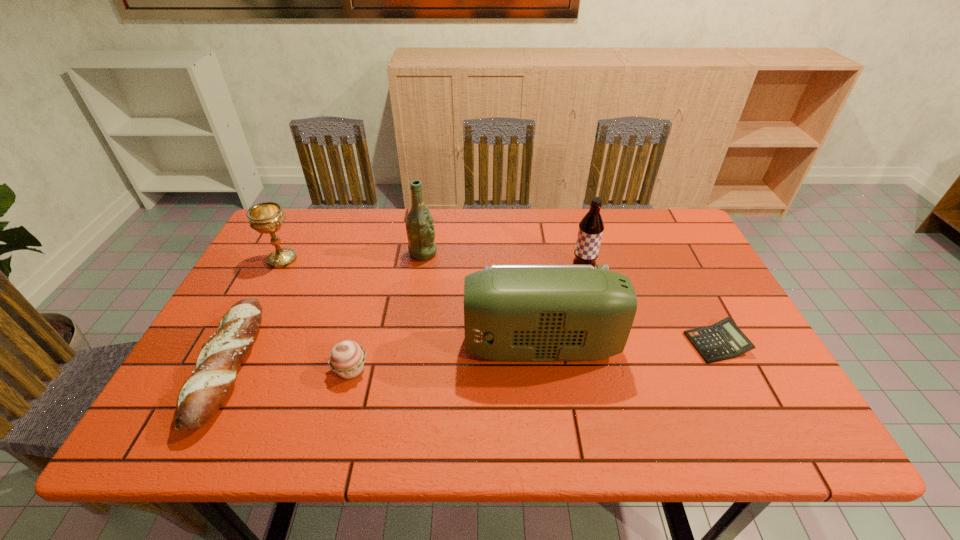
This screenshot has height=540, width=960. Find the location of `vacant region located 0.320m on the left of the root beer`. vacant region located 0.320m on the left of the root beer is located at coordinates [x=459, y=271].

Where is `free spot located 0.360m on the front-facing side of the radio_receiver`? Image resolution: width=960 pixels, height=540 pixels. free spot located 0.360m on the front-facing side of the radio_receiver is located at coordinates (316, 347).

Locate an element on the screen. This screenshot has height=540, width=960. free space located on the front-facing side of the radio_receiver is located at coordinates (396, 347).

Where is `vacant space located 0.180m on the front-facing side of the radio_receiver`? vacant space located 0.180m on the front-facing side of the radio_receiver is located at coordinates coord(391,347).

Identify the location of vacant space located 0.080m on the front of the chalice. (267, 289).

The image size is (960, 540). In order to click on vacant area situated on the left of the cupcake in this screenshot , I will do `click(201, 369)`.

Find the location of `vacant point located on the back of the second shortest object`. vacant point located on the back of the second shortest object is located at coordinates (300, 228).

You are a GUI agent. You are given a task and a screenshot of the screen. Output one action in this format:
    pyautogui.click(x=<x>, y=<y>)
    Task: Click on the free region located 0.260m on the left of the calculator
    The width and height of the screenshot is (960, 540).
    Given the screenshot: What is the action you would take?
    pyautogui.click(x=580, y=343)

Identify the location of beer bottle that is at the far edge. This screenshot has width=960, height=540. (419, 223).

At what (x,y) coordinates should I click in order to perform the action: click on chalice present at the far edge. Please return your answer as a coordinate pair (x, y). The width and height of the screenshot is (960, 540). Looking at the image, I should click on (267, 217).